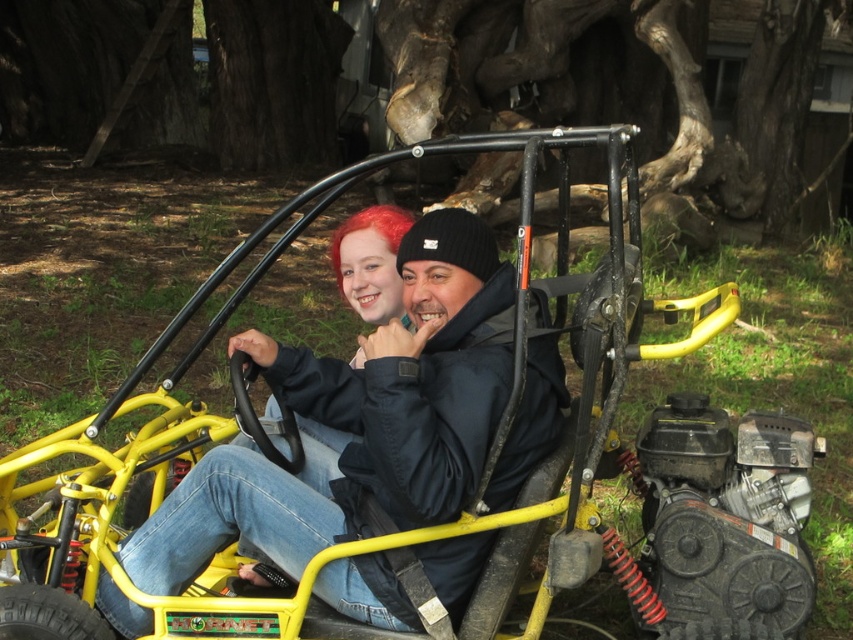
Consider the image. How far apart are matte black jacket at center and vivid red hair at center?

matte black jacket at center and vivid red hair at center are 34.67 inches apart.

Which is in front, point (225, 465) or point (395, 214)?

Point (225, 465) is more forward.

Is point (451, 592) positioned after point (379, 225)?

No, it is not.

At what (x,y) coordinates should I click in order to perform the action: click on matte black jacket at center. Please return your answer as a coordinate pair (x, y). The image size is (853, 640). Looking at the image, I should click on (357, 420).